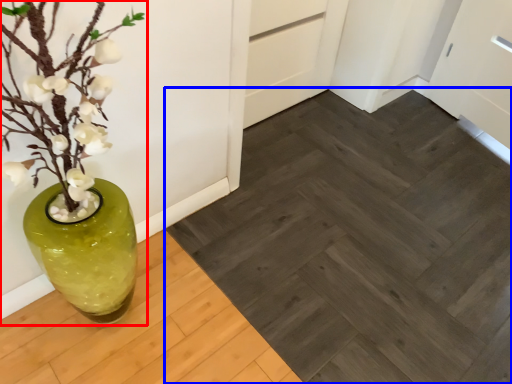
Question: Which object is closer to the camera taking this photo, houseplant (highlighted by a red box) or plank (highlighted by a blue box)?

Choices:
 (A) houseplant
 (B) plank

Answer: (A)